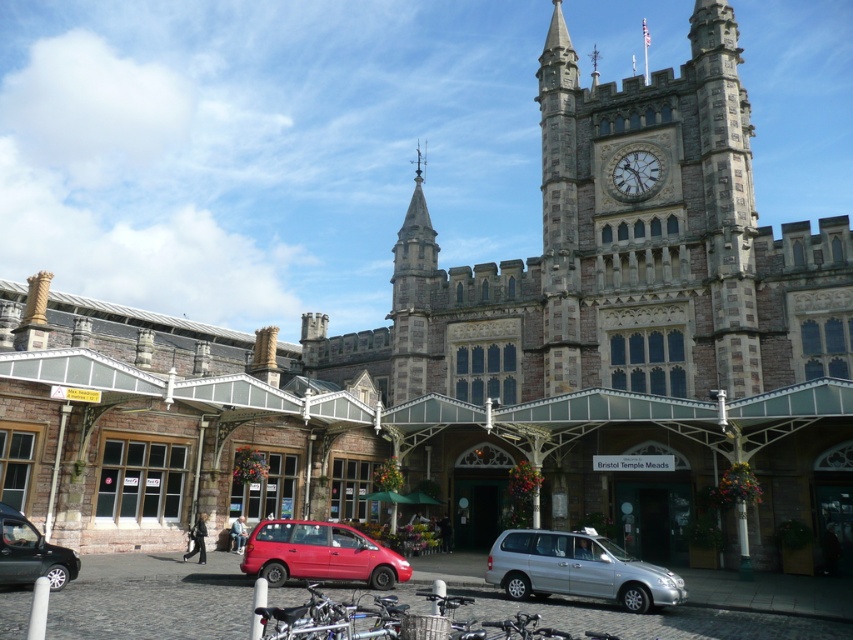
Question: Considering the real-world distances, which object is farthest from the silver metallic van at center?

Choices:
 (A) matte black car at lower left
 (B) matte red minivan at center
 (C) stone clock at upper right

Answer: (C)

Question: Can you confirm if silver metallic van at center is wider than matte black car at lower left?

Choices:
 (A) yes
 (B) no

Answer: (A)

Question: Is matte red minivan at center bigger than stone clock at upper right?

Choices:
 (A) yes
 (B) no

Answer: (A)

Question: Which point is closer to the camera?

Choices:
 (A) silver metallic van at center
 (B) stone clock at upper right
 (C) matte black car at lower left
 (D) matte red minivan at center

Answer: (C)

Question: Based on their relative distances, which object is nearer to the stone clock at upper right?

Choices:
 (A) matte black car at lower left
 (B) silver metallic van at center
 (C) matte red minivan at center

Answer: (B)

Question: Is matte black car at lower left behind stone clock at upper right?

Choices:
 (A) no
 (B) yes

Answer: (A)